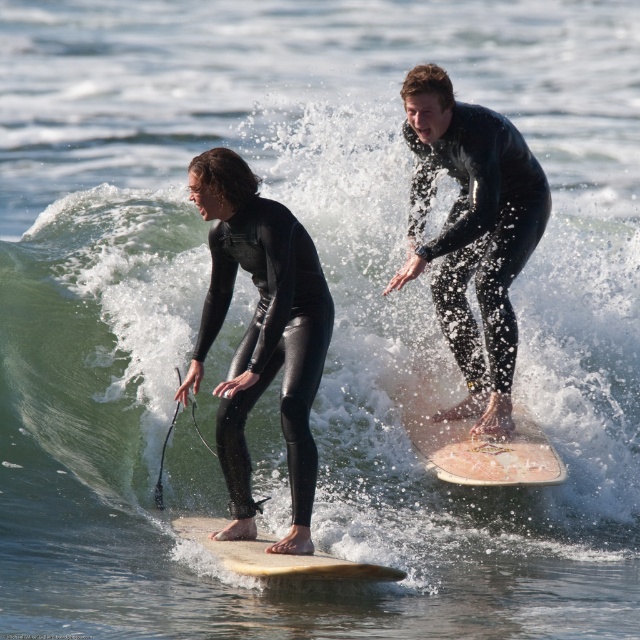
Question: Which point is closer to the camera taking this photo?

Choices:
 (A) (448, 442)
 (B) (390, 285)
 (C) (470, 212)
 (D) (264, 541)

Answer: (D)

Question: Can you confirm if black matte wetsuit at center is smaller than light brown smooth surfboard at center?

Choices:
 (A) no
 (B) yes

Answer: (A)

Question: Is black matte wetsuit at center bigger than black matte wetsuit at upper center?

Choices:
 (A) yes
 (B) no

Answer: (B)

Question: Does black matte wetsuit at center appear under black matte wetsuit at upper center?

Choices:
 (A) no
 (B) yes

Answer: (B)

Question: Which point is closer to the camera taking this photo?

Choices:
 (A) (456, 300)
 (B) (252, 257)

Answer: (B)

Question: Which object is closer to the camera taking this photo?

Choices:
 (A) light pink smooth surfboard at center
 (B) black matte wetsuit at center
 (C) black matte wetsuit at upper center
 (D) light brown smooth surfboard at center

Answer: (D)